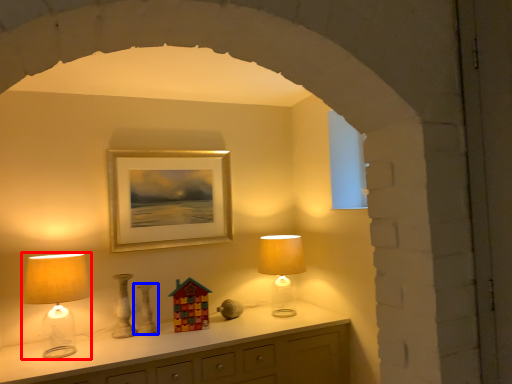
Question: Which point is closer to the camera, lamp (highlighted by a red box) or vase (highlighted by a blue box)?

Choices:
 (A) lamp
 (B) vase

Answer: (A)